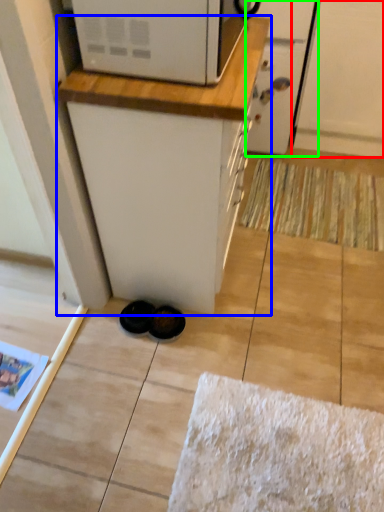
Question: Which object is the farthest from screen door (highlighted by a red box)? Choose among these: cabinetry (highlighted by a blue box) or screen door (highlighted by a green box).

Choices:
 (A) cabinetry
 (B) screen door

Answer: (A)